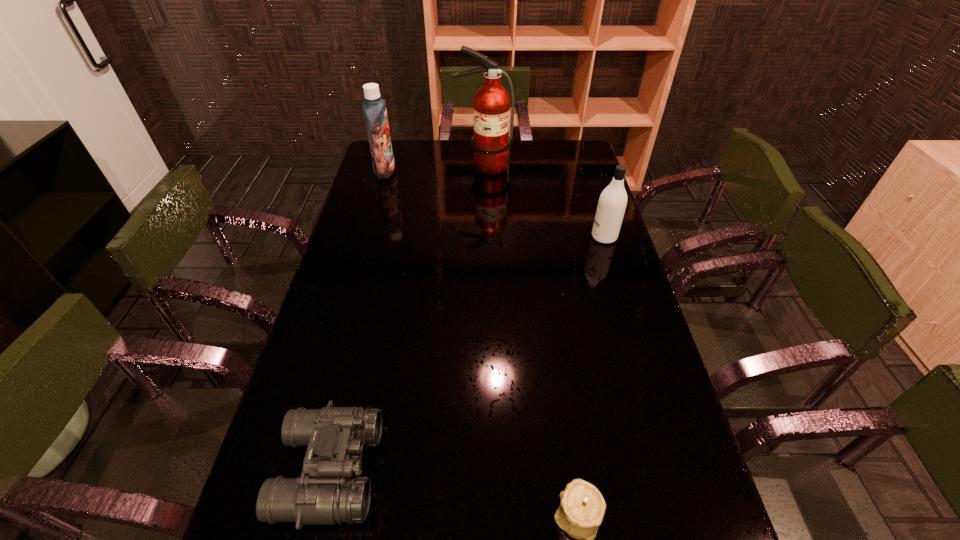
Find the location of a particular element. free space located on the front-facing side of the nearer shampoo is located at coordinates (556, 237).

Identify the location of free space located 0.370m on the front-facing side of the nearer shampoo. The height and width of the screenshot is (540, 960). (482, 237).

At what (x,y) coordinates should I click in order to perform the action: click on blank area located 0.200m through the lenses of the binoculars. Please return your answer as a coordinate pair (x, y). The width and height of the screenshot is (960, 540). Looking at the image, I should click on (469, 470).

Identify the location of fire extinguisher at the far edge. Image resolution: width=960 pixels, height=540 pixels. (491, 105).

Find the location of `shampoo that is at the far edge`. shampoo that is at the far edge is located at coordinates (374, 107).

This screenshot has height=540, width=960. In order to click on shampoo that is at the left edge in this screenshot , I will do `click(374, 107)`.

Where is `binoculars at the left edge`? binoculars at the left edge is located at coordinates (325, 494).

Locate an element on the screen. The image size is (960, 540). object that is at the right edge is located at coordinates (612, 202).

Where is `object located at the far left corner`? The image size is (960, 540). object located at the far left corner is located at coordinates (374, 107).

This screenshot has width=960, height=540. I want to click on vacant space at the far edge of the desktop, so click(x=516, y=168).